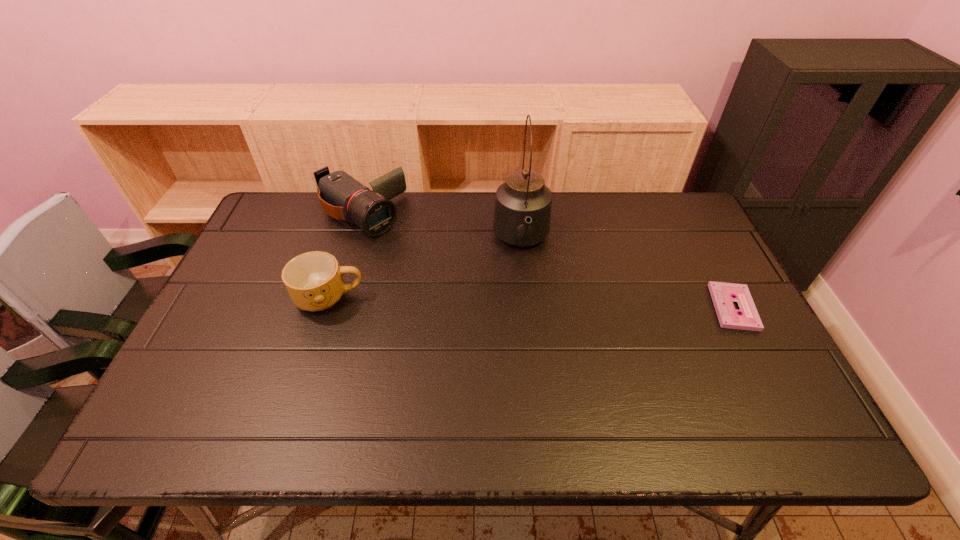
This screenshot has height=540, width=960. I want to click on blank space that satisfies the following two spatial constraints: 1. on the front side of the shortest object; 2. on the left side of the third object from left to right, so click(528, 307).